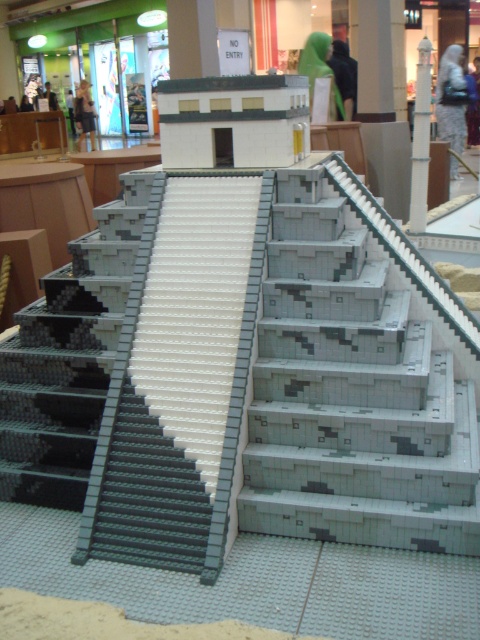
You are a photographer standing in front of the LEGO pyramid. You want to take a photo that captures both the point at coordinates point (323, 484) and point (44, 404). Which point will appear larger in the photo?

Point (323, 484) will appear larger in the photo because it is closer to the camera than point (44, 404).